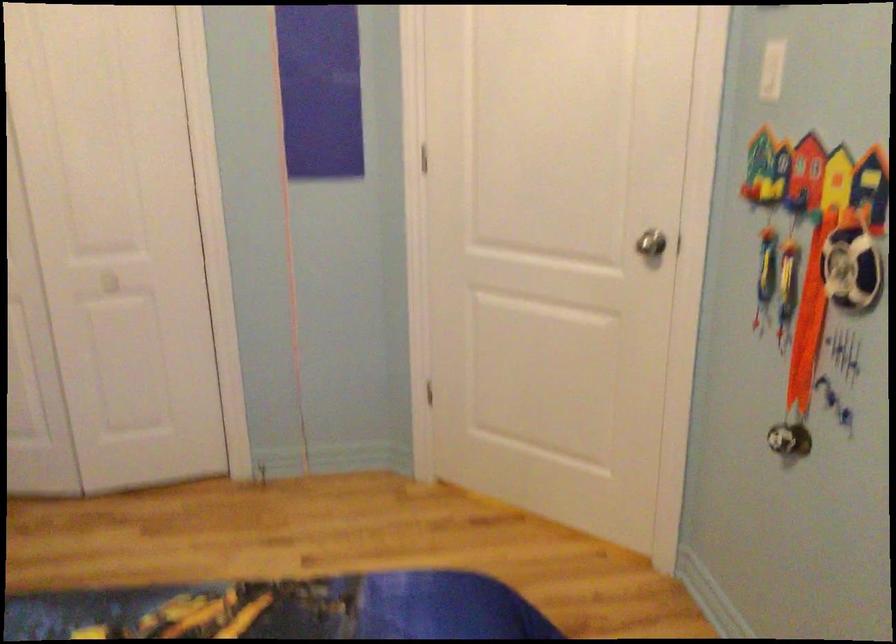
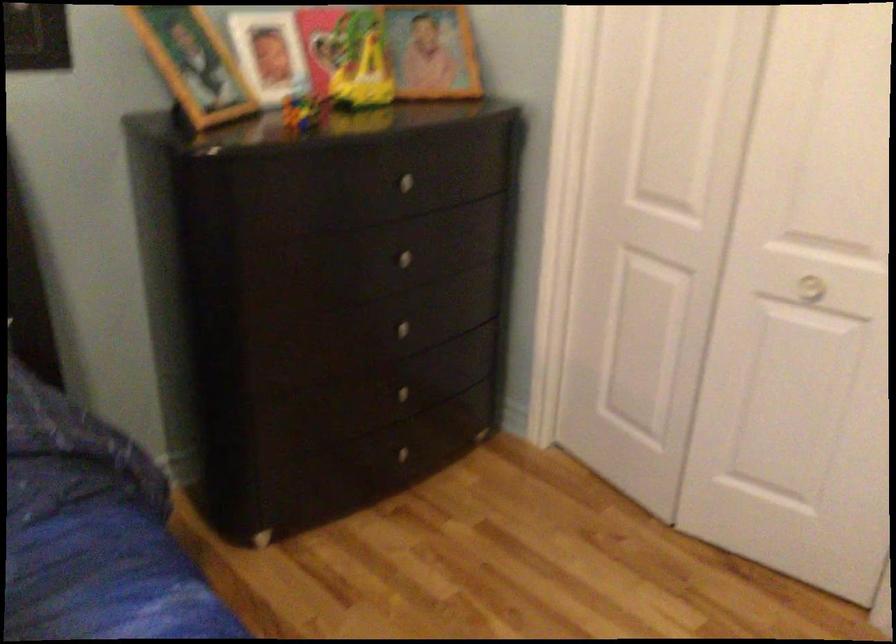
Question: I am providing you with two images of the same scene from different viewpoints. Which of the following objects are not visible in image2?

Choices:
 (A) white door knob
 (B) small puzzle cube
 (C) silver drawer knob
 (D) none of these

Answer: (D)